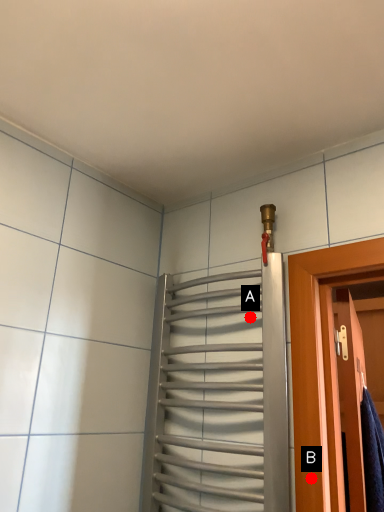
Question: Two points are circled on the image, labeled by A and B beside each circle. Which point appears farthest from the camera in this image?

Choices:
 (A) A is further
 (B) B is further

Answer: (A)